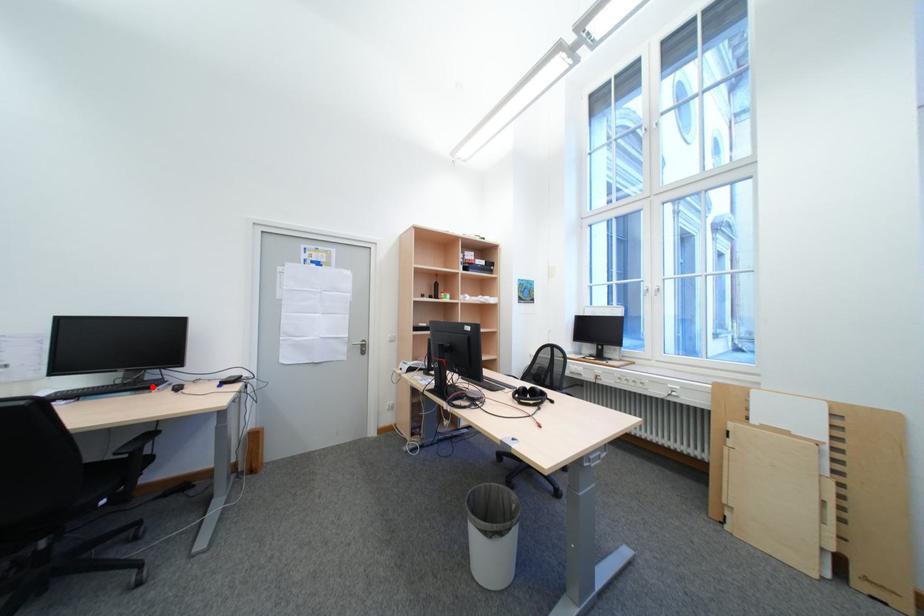
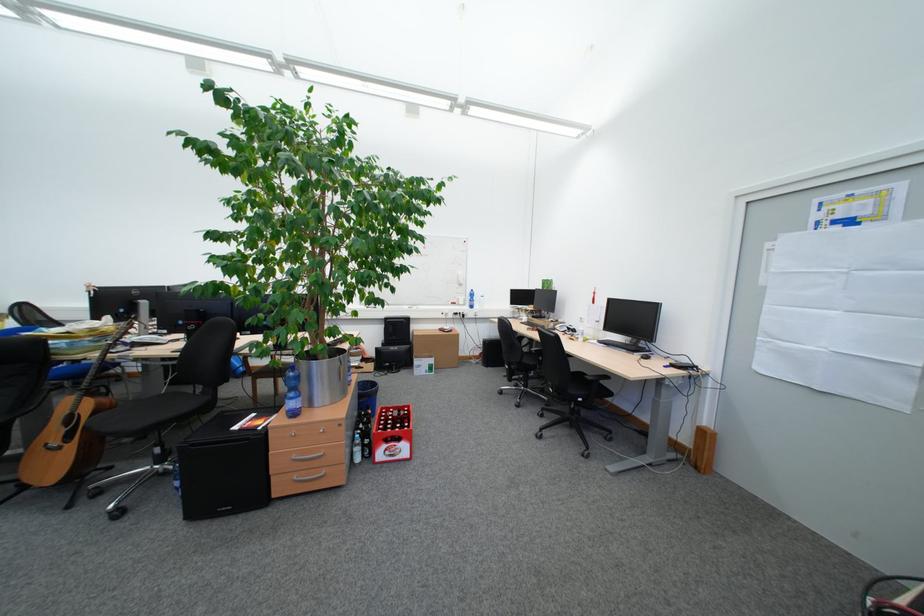
Where in the second image is the point corresponding to the highlighted location from the first image?

(642, 350)